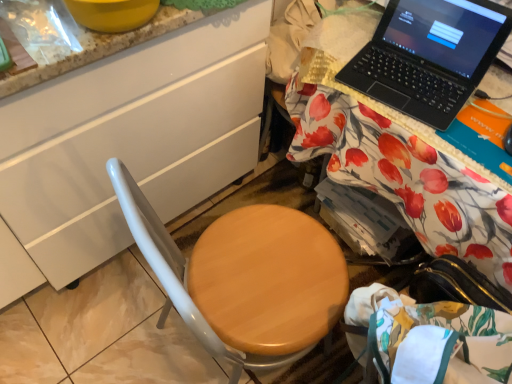
The width and height of the screenshot is (512, 384). In order to click on free spot below black plastic laptop at upper right (from a real-world perspective) in this screenshot , I will do (x=413, y=85).